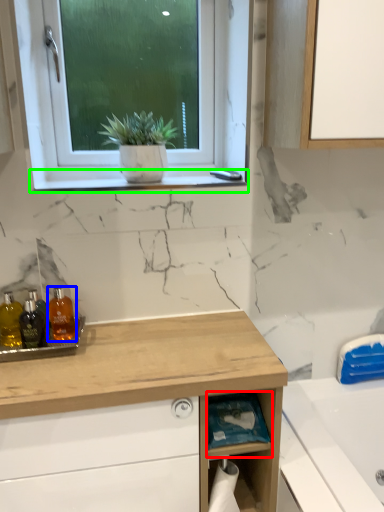
Question: Estimate the real-world distances between objects in this image. Which object is farther from shelf (highlighted by a red box), toiletry (highlighted by a blue box) or window sill (highlighted by a green box)?

Choices:
 (A) toiletry
 (B) window sill

Answer: (B)